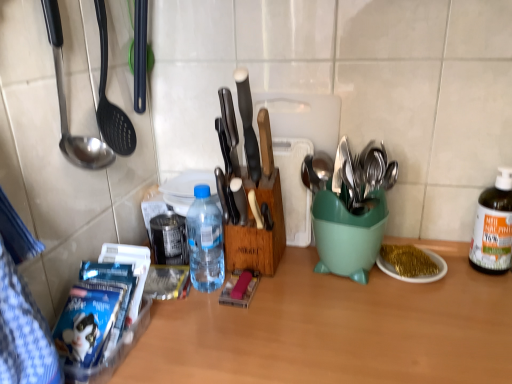
Find the location of a particular element. vacant region to the right of green plastic spoon holder at right is located at coordinates (463, 290).